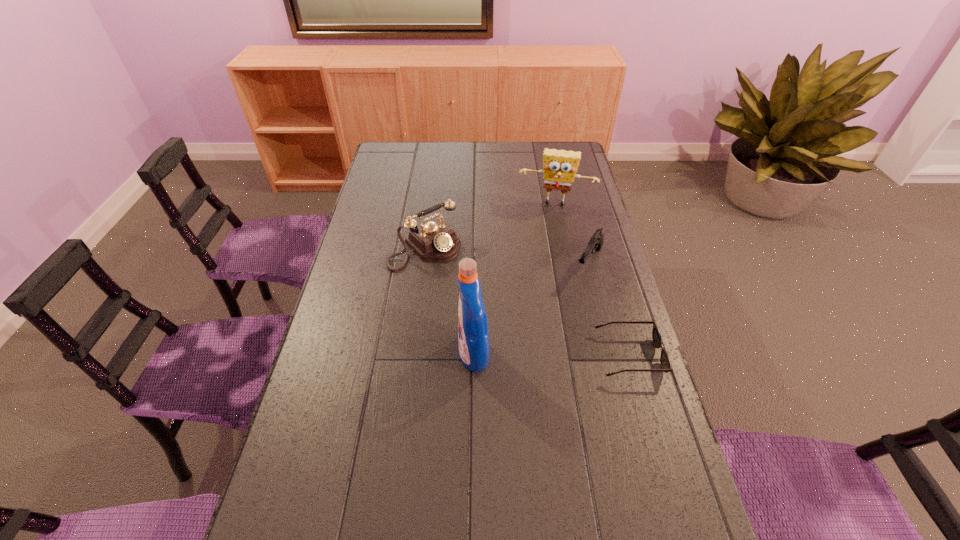
Locate an element on the screen. This screenshot has height=540, width=960. empty location between the gun and the telephone is located at coordinates (507, 255).

Where is `free space that is in between the shortest object and the sponge`? The image size is (960, 540). free space that is in between the shortest object and the sponge is located at coordinates (592, 280).

Identify the location of free space between the second object from left to right and the shortest object. Image resolution: width=960 pixels, height=540 pixels. (551, 355).

This screenshot has width=960, height=540. Find the location of `empty space between the second shortest object and the detergent`. empty space between the second shortest object and the detergent is located at coordinates (531, 309).

The image size is (960, 540). What are the coordinates of `blank region between the fourth object from right to left and the third shortest object` in the screenshot? It's located at (449, 301).

Find the location of `vacant area that lies between the farthest object and the detergent`. vacant area that lies between the farthest object and the detergent is located at coordinates (515, 279).

Where is `vacant area that lies between the farthest object and the gun`? The width and height of the screenshot is (960, 540). vacant area that lies between the farthest object and the gun is located at coordinates (572, 233).

At what (x,y) coordinates should I click in order to perform the action: click on vacant area that lies between the fourth shortest object and the fourth tallest object. Please return your answer as a coordinate pair (x, y). Looking at the image, I should click on (572, 233).

I want to click on unoccupied position between the fourth tallest object and the shortest object, so click(609, 309).

Locate an element on the screen. The image size is (960, 540). vacant region between the telephone and the sunglasses is located at coordinates (527, 301).